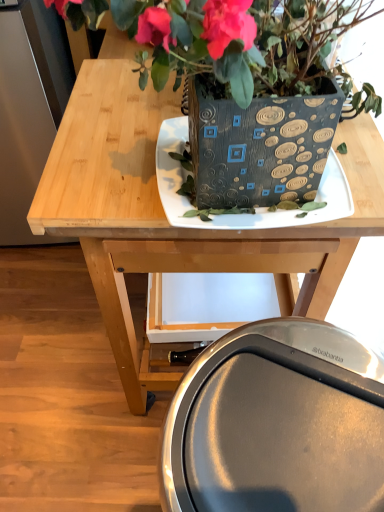
Question: Could metallic silver swivel chair at lower center be considered to be inside matte black plate at center?

Choices:
 (A) yes
 (B) no

Answer: (B)

Question: Considering the relative positions of matte black plate at center and metallic silver swivel chair at lower center in the image provided, is matte black plate at center to the right of metallic silver swivel chair at lower center from the viewer's perspective?

Choices:
 (A) yes
 (B) no

Answer: (B)

Question: Does matte black plate at center have a lesser height compared to metallic silver swivel chair at lower center?

Choices:
 (A) no
 (B) yes

Answer: (B)

Question: Is matte black plate at center turned away from metallic silver swivel chair at lower center?

Choices:
 (A) no
 (B) yes

Answer: (A)

Question: Does matte black plate at center turn towards metallic silver swivel chair at lower center?

Choices:
 (A) yes
 (B) no

Answer: (B)

Question: Considering the positions of matte black plate at center and metallic silver swivel chair at lower center in the image, is matte black plate at center wider or thinner than metallic silver swivel chair at lower center?

Choices:
 (A) wide
 (B) thin

Answer: (B)

Question: In terms of height, does matte black plate at center look taller or shorter compared to metallic silver swivel chair at lower center?

Choices:
 (A) short
 (B) tall

Answer: (A)

Question: Is matte black plate at center in front of or behind metallic silver swivel chair at lower center in the image?

Choices:
 (A) front
 (B) behind

Answer: (B)

Question: Is matte black plate at center situated inside metallic silver swivel chair at lower center or outside?

Choices:
 (A) inside
 (B) outside

Answer: (B)

Question: Is point (233, 452) positioned closer to the camera than point (172, 221)?

Choices:
 (A) closer
 (B) farther

Answer: (B)

Question: Is metallic silver swivel chair at lower center inside the boundaries of matte black plate at center, or outside?

Choices:
 (A) inside
 (B) outside

Answer: (B)

Question: Looking at their shapes, would you say metallic silver swivel chair at lower center is wider or thinner than matte black plate at center?

Choices:
 (A) wide
 (B) thin

Answer: (A)

Question: In terms of size, does metallic silver swivel chair at lower center appear bigger or smaller than matte black plate at center?

Choices:
 (A) small
 (B) big

Answer: (B)

Question: Considering the positions of matte black plate at center and wooden table at center in the image, is matte black plate at center taller or shorter than wooden table at center?

Choices:
 (A) short
 (B) tall

Answer: (A)

Question: Visually, is matte black plate at center positioned to the left or to the right of wooden table at center?

Choices:
 (A) right
 (B) left

Answer: (A)